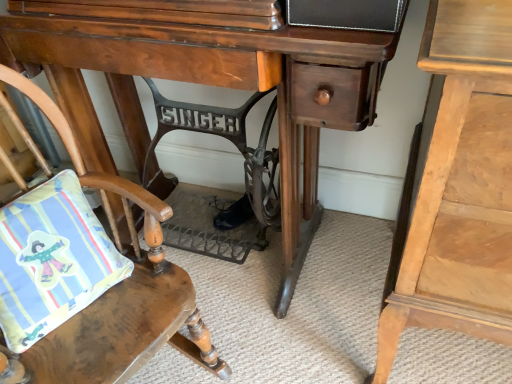
Question: From the image's perspective, is wooden cushioned chair at lower left located above or below matte cotton pillow at lower left?

Choices:
 (A) above
 (B) below

Answer: (B)

Question: From their relative heights in the image, would you say wooden cushioned chair at lower left is taller or shorter than matte cotton pillow at lower left?

Choices:
 (A) short
 (B) tall

Answer: (B)

Question: Which of these objects is positioned closest to the matte cotton pillow at lower left?

Choices:
 (A) wooden desk at center
 (B) wooden cushioned chair at lower left
 (C) light wood nightstand at right

Answer: (B)

Question: Based on their relative distances, which object is nearer to the light wood nightstand at right?

Choices:
 (A) matte cotton pillow at lower left
 (B) wooden desk at center
 (C) wooden cushioned chair at lower left

Answer: (B)